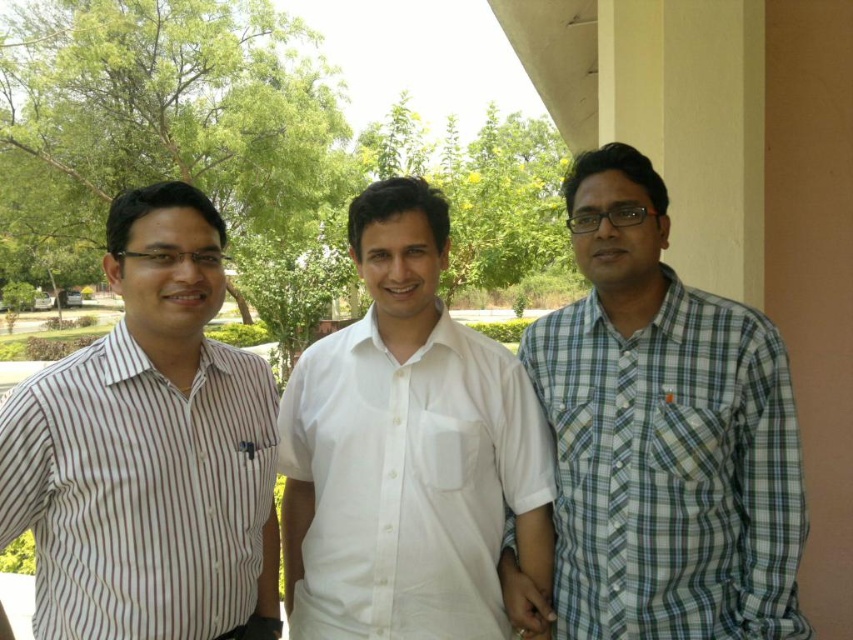
Question: Among these objects, which one is nearest to the camera?

Choices:
 (A) white cotton shirt at center
 (B) white striped shirt at left
 (C) checkered fabric shirt at right

Answer: (B)

Question: Can you confirm if white striped shirt at left is positioned above white cotton shirt at center?

Choices:
 (A) no
 (B) yes

Answer: (B)

Question: Is white striped shirt at left above white cotton shirt at center?

Choices:
 (A) no
 (B) yes

Answer: (B)

Question: Which object is closer to the camera taking this photo?

Choices:
 (A) white striped shirt at left
 (B) white cotton shirt at center

Answer: (A)

Question: Does white striped shirt at left have a greater width compared to white cotton shirt at center?

Choices:
 (A) yes
 (B) no

Answer: (B)

Question: Which of these objects is positioned farthest from the white striped shirt at left?

Choices:
 (A) white cotton shirt at center
 (B) checkered fabric shirt at right

Answer: (B)